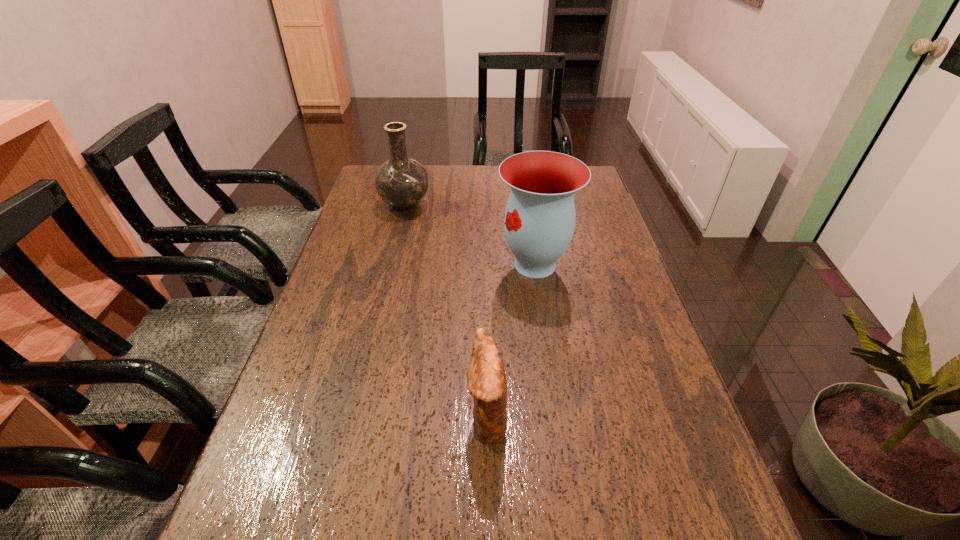
Find the location of `the right vase`. the right vase is located at coordinates (x=539, y=222).

Locate an element on the screen. This screenshot has width=960, height=540. the nearer vase is located at coordinates (539, 222).

The height and width of the screenshot is (540, 960). I want to click on the farthest object, so click(402, 182).

Find the location of a particular element. the farther vase is located at coordinates (402, 182).

This screenshot has height=540, width=960. I want to click on clutch bag, so click(487, 384).

Find the location of a particular element. the shortest object is located at coordinates (487, 384).

This screenshot has height=540, width=960. Identify the location of free space located on the left of the nearer vase. (420, 265).

This screenshot has height=540, width=960. In order to click on free spot located on the front of the left vase in this screenshot , I will do `click(396, 242)`.

You are a GUI agent. You are given a task and a screenshot of the screen. Output one action in this format:
    pyautogui.click(x=<x>, y=<y>)
    Task: Click on the free spot located 0.320m on the open side of the nearest object
    The width and height of the screenshot is (960, 540).
    Given the screenshot: What is the action you would take?
    pyautogui.click(x=311, y=417)

The height and width of the screenshot is (540, 960). What are the coordinates of `vacant space located 0.070m on the open side of the nearest object` in the screenshot? It's located at (434, 417).